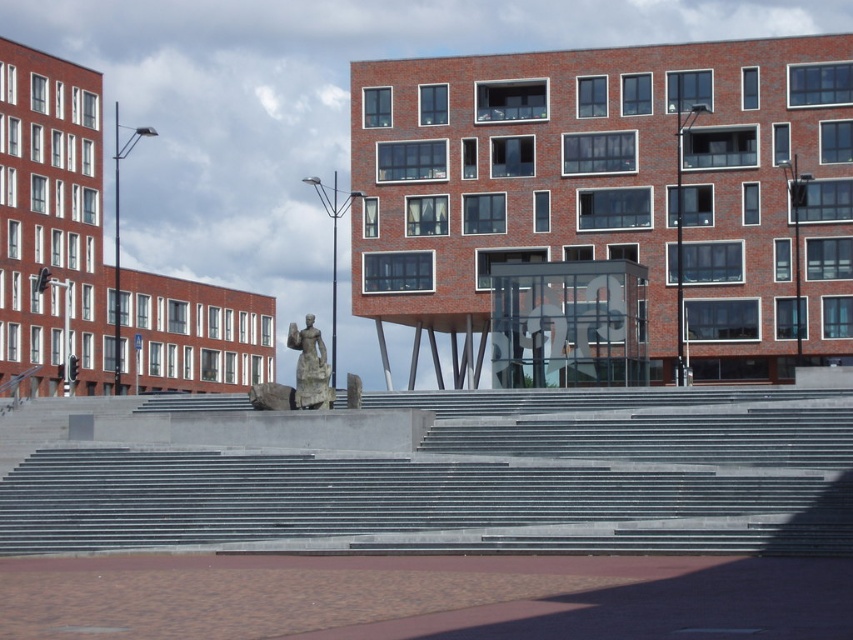
You are a delivery person trying to navigate through the plaza area. You need to move a large rectangular box that is 2 meters wide. The box must be carried along the smooth concrete stairs at center and past the polished bronze statue at center. Can the box fit through the space between the stairs and the statue?

The smooth concrete stairs at center are wider than the polished bronze statue at center. Since the box is 2 meters wide, it should fit as long as the narrowest point between them allows. However, without exact measurements, we can infer that since the stairs are wider, there might be sufficient space. But this is uncertain without precise dimensions.

You are standing at the base of the gray concrete steps leading to the plaza in front of the two red brick buildings. You need to walk to the exact location marked by the point at coordinates (x=476, y=481). Which direction should you walk relative to the steps?

The point at coordinates (x=476, y=481) marks the smooth concrete stairs at center, so you should walk straight up the center of the gray concrete steps to reach that location.

You are an urban planner assessing the space between the two statues located at the center of the plaza. Given that the stone statue at center is narrower than the polished bronze statue at center, can a 1.2 meter wide bench be placed between them without touching either?

The stone statue at center is narrower than the polished bronze statue at center. Since the bench is 1.2 meters wide, it can be placed between them if there is sufficient space. However, the exact placement depends on the statues actual widths. Without specific measurements, we cannot confirm if the bench will fit.